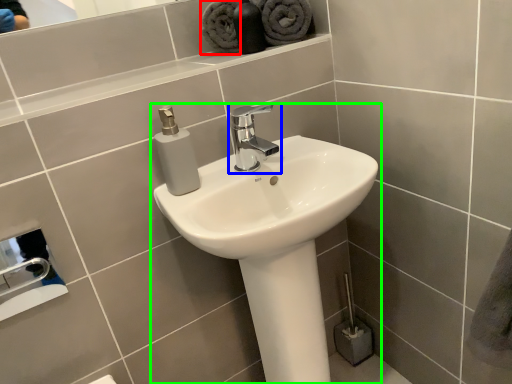
Question: Which is nearer to the bath towel (highlighted by a red box)? tap (highlighted by a blue box) or sink (highlighted by a green box).

Choices:
 (A) tap
 (B) sink

Answer: (A)